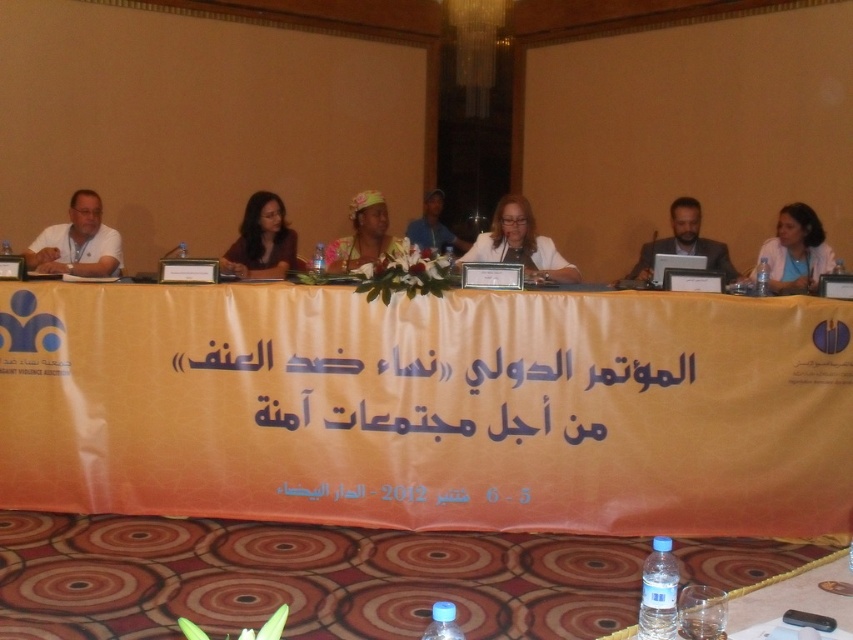
Which of these two, matte white laptop at center or dark brown hair at center, stands taller?

dark brown hair at center

Looking at this image, between matte white laptop at center and dark brown hair at center, which one is positioned lower?

matte white laptop at center is lower down.

What do you see at coordinates (520, 243) in the screenshot? I see `matte white laptop at center` at bounding box center [520, 243].

Where is `matte white laptop at center`? Image resolution: width=853 pixels, height=640 pixels. matte white laptop at center is located at coordinates (520, 243).

Who is higher up, orange paper banner at center or white matte shirt at left?

white matte shirt at left is higher up.

Image resolution: width=853 pixels, height=640 pixels. Describe the element at coordinates (422, 387) in the screenshot. I see `orange paper banner at center` at that location.

The width and height of the screenshot is (853, 640). Find the location of `orange paper banner at center`. orange paper banner at center is located at coordinates (422, 387).

Is orange paper banner at center smaller than matte white laptop at center?

Indeed, orange paper banner at center has a smaller size compared to matte white laptop at center.

Can you confirm if orange paper banner at center is positioned to the right of matte white laptop at center?

In fact, orange paper banner at center is to the left of matte white laptop at center.

Is point (323, 362) in front of point (509, 204)?

Yes, point (323, 362) is in front of point (509, 204).

This screenshot has height=640, width=853. Identify the location of orange paper banner at center. (422, 387).